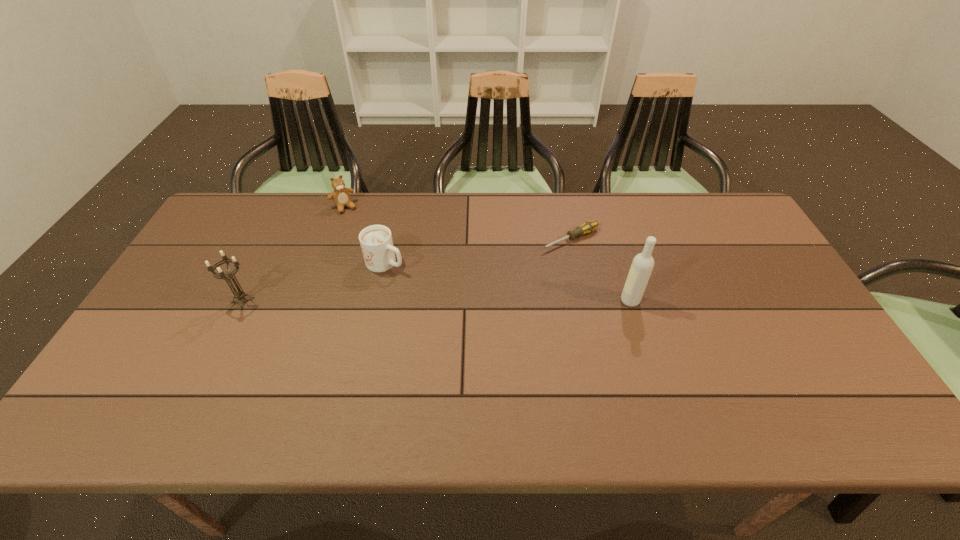
This screenshot has height=540, width=960. In order to click on free space located 0.090m on the back of the tallest object in this screenshot , I will do `click(621, 271)`.

Identify the location of vacant area situated 0.090m at the tip of the shortest object. (522, 258).

Find the location of a particular element. The height and width of the screenshot is (540, 960). vacant area located at the tip of the shortest object is located at coordinates (471, 281).

What are the coordinates of `vacant space located 0.390m at the tip of the shortest object` in the screenshot? It's located at (435, 298).

Identify the location of vacant space located 0.360m on the side with the handle of the cappuccino. (505, 323).

Locate an element on the screen. This screenshot has height=540, width=960. free location located on the side with the handle of the cappuccino is located at coordinates (428, 283).

Identify the location of vacant position located 0.190m on the side with the handle of the cappuccino. This screenshot has width=960, height=540. (453, 296).

In order to click on free space located on the front-facing side of the fourth object from right to left in this screenshot , I will do `click(373, 251)`.

In order to click on vacant area situated 0.300m on the front-facing side of the fourth object from right to left in this screenshot , I will do `click(383, 267)`.

Find the location of a particular element. This screenshot has width=960, height=540. vacant region located on the front-facing side of the fourth object from right to left is located at coordinates (367, 242).